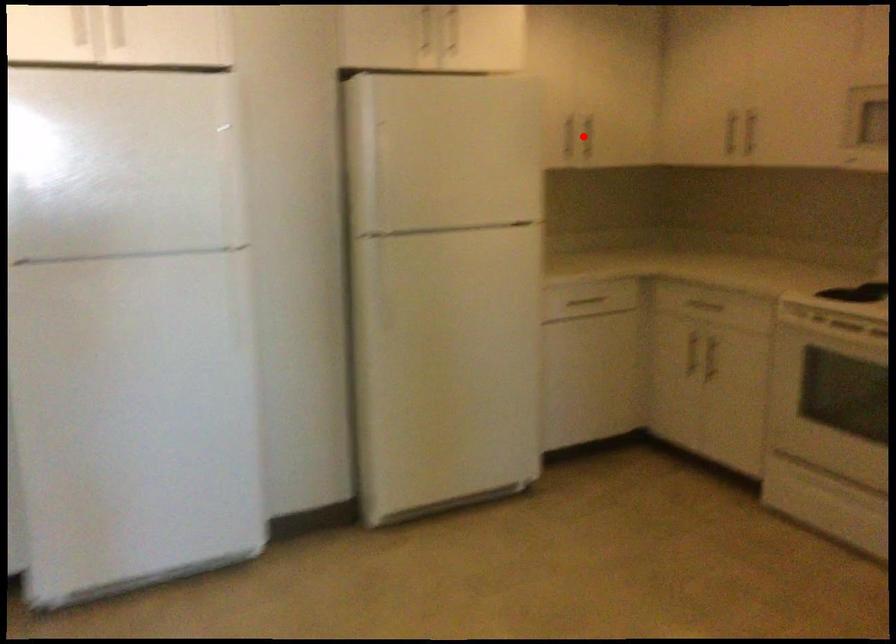
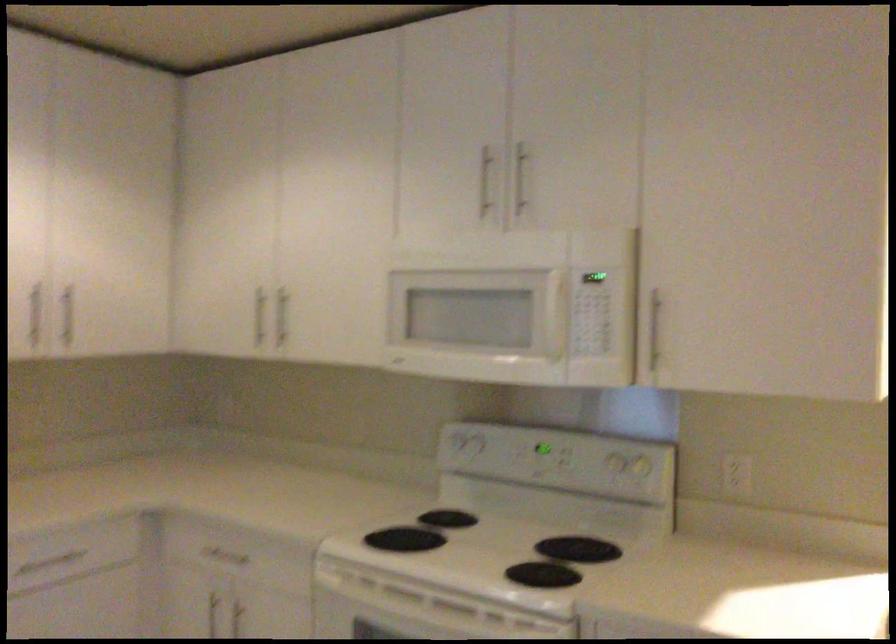
Question: A red point is marked in image1. In image2, is the corresponding 3D point closer to the camera or farther? Reply with the corresponding letter.

Choices:
 (A) The corresponding 3D point is closer.
 (B) The corresponding 3D point is farther.

Answer: (A)